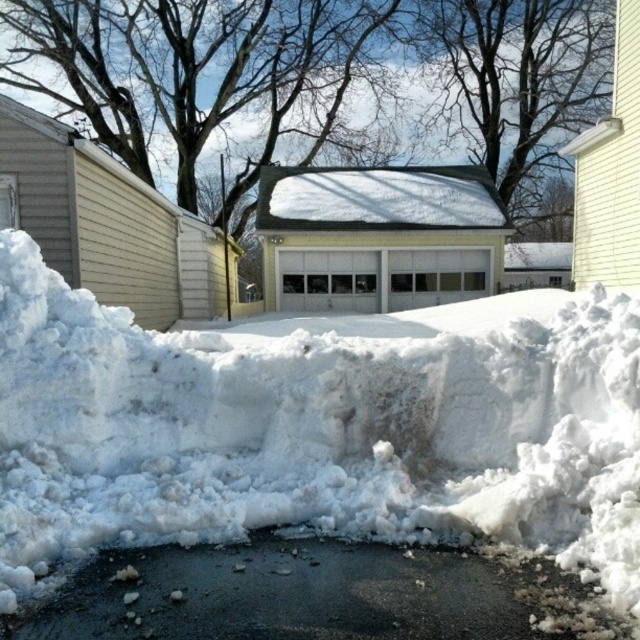
You are a delivery person trying to deliver a package to the house. The driveway has white fluffy snow at center and black asphalt at center. Which part of the driveway is more likely to be slippery? Please explain your reasoning.

The black asphalt at center is more likely to be slippery because it has a larger size compared to the white fluffy snow at center, which may provide better traction due to its texture and fluffiness.

Based on the photo, you are a snowplow operator trying to clear the driveway. You see the white fluffy snow at center and the black asphalt at center. Which area should you focus on first to ensure safe passage?

The white fluffy snow at center is further to the viewer than the black asphalt at center, so you should focus on clearing the white fluffy snow at center first to create a clear path over the black asphalt at center.